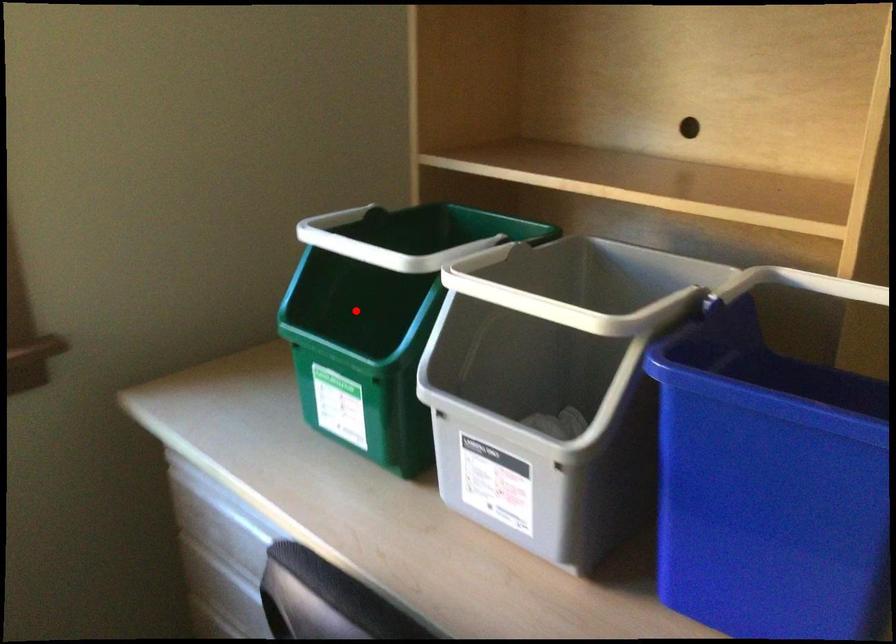
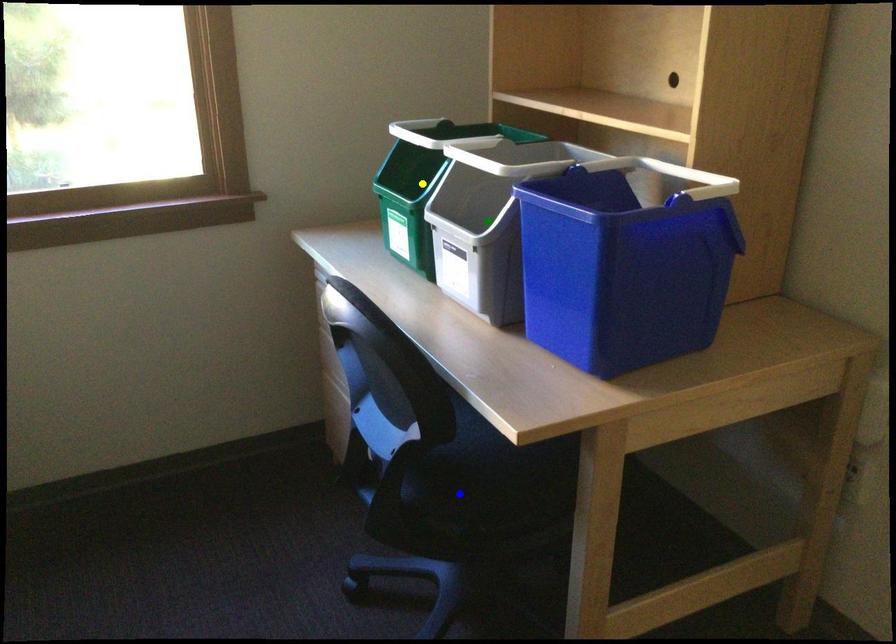
Question: I am providing you with two images of the same scene from different viewpoints. A red point is marked on the first image. You are given multiple points on the second image. In image 2, which mark is for the same physical point as the one in image 1?

Choices:
 (A) green point
 (B) yellow point
 (C) blue point

Answer: (B)